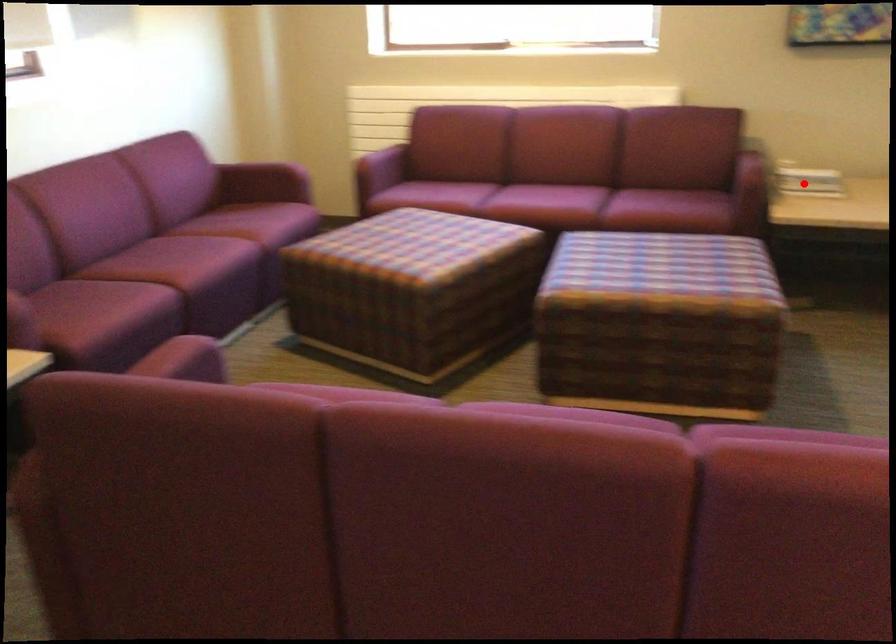
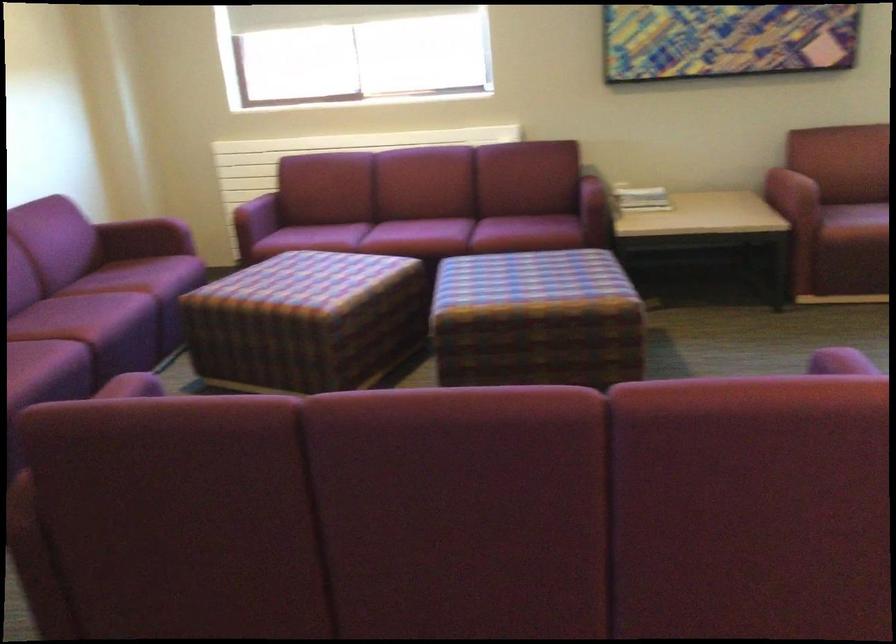
In the second image, find the point that corresponds to the highlighted location in the first image.

(640, 198)